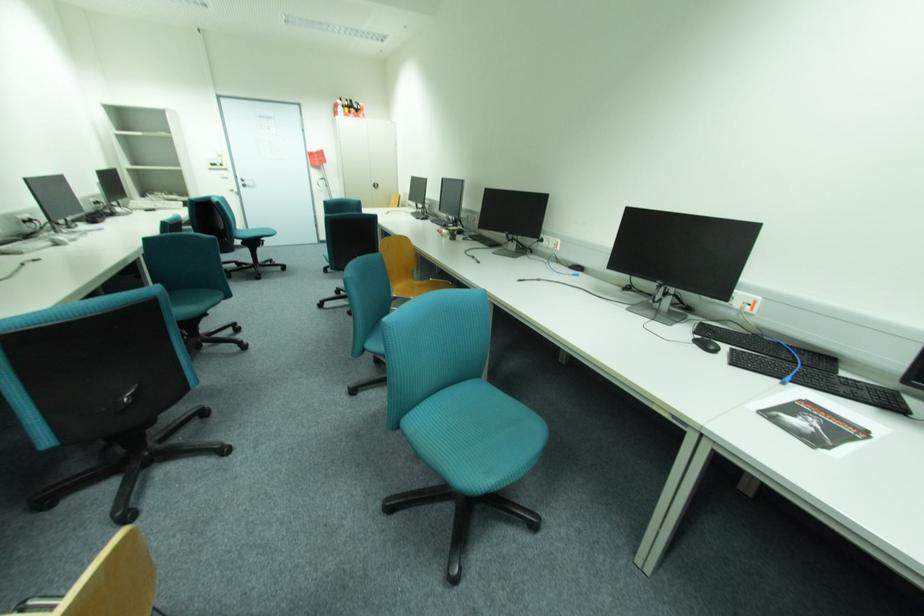
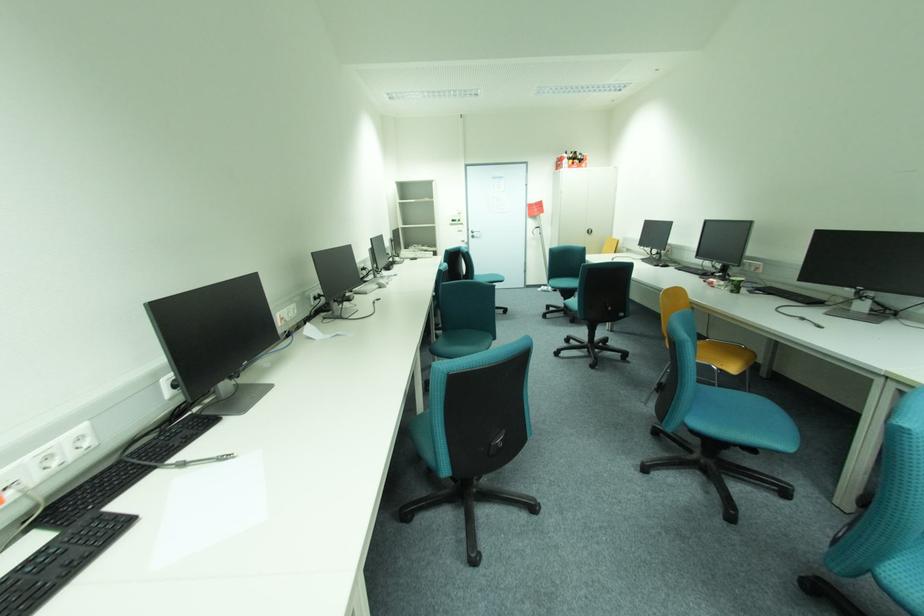
Question: In a continuous first-person perspective shot, in which direction is the camera moving?

Choices:
 (A) Left
 (B) Right
 (C) Forward
 (D) Backward

Answer: (A)